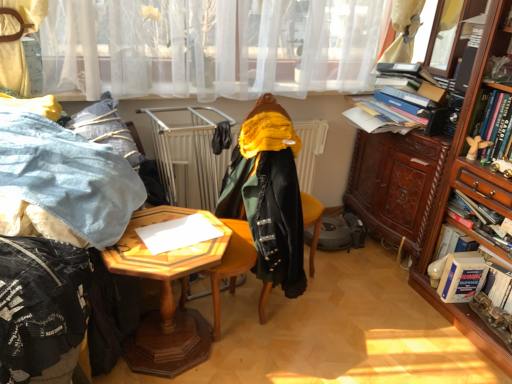
At what (x,y) coordinates should I click in order to perform the action: click on free space to the right of velvet black coat at center. Please return your answer as a coordinate pair (x, y). The image size is (512, 384). Looking at the image, I should click on (302, 340).